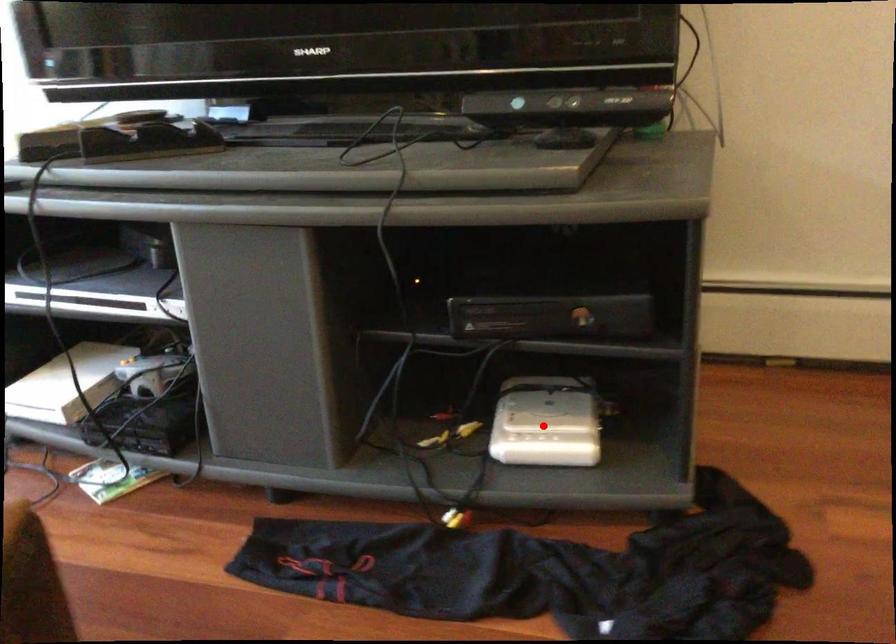
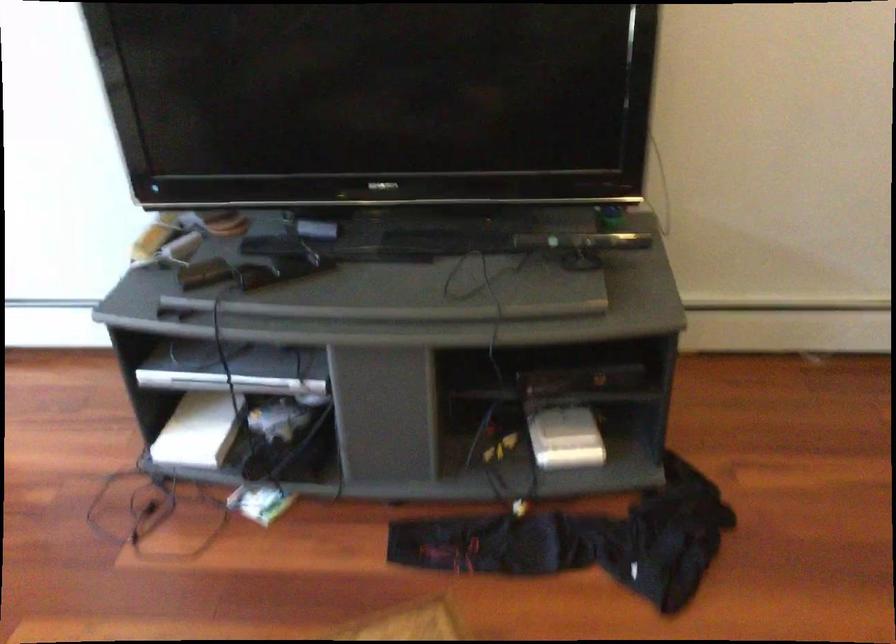
Where in the second image is the point corresponding to the highlighted location from the first image?

(565, 438)